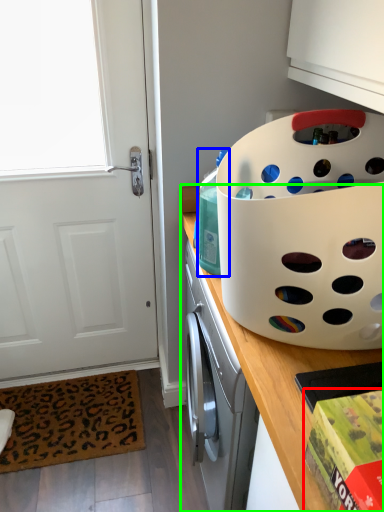
Question: Which object is the closest to the box (highlighted by a red box)? Choose among these: bottle (highlighted by a blue box) or countertop (highlighted by a green box).

Choices:
 (A) bottle
 (B) countertop

Answer: (B)